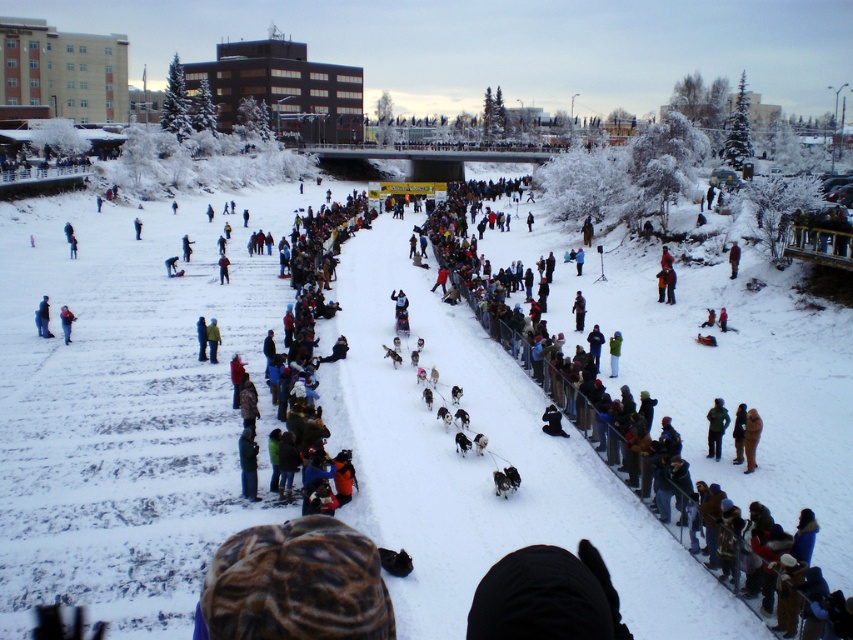
You are a photographer trying to capture a clear shot of the brown woolen hat at center and the white snow at center. Based on their positions, which object should you focus on first to ensure both are in focus?

The brown woolen hat at center is below the white snow at center, so you should focus on the brown woolen hat at center first to ensure both are in focus.